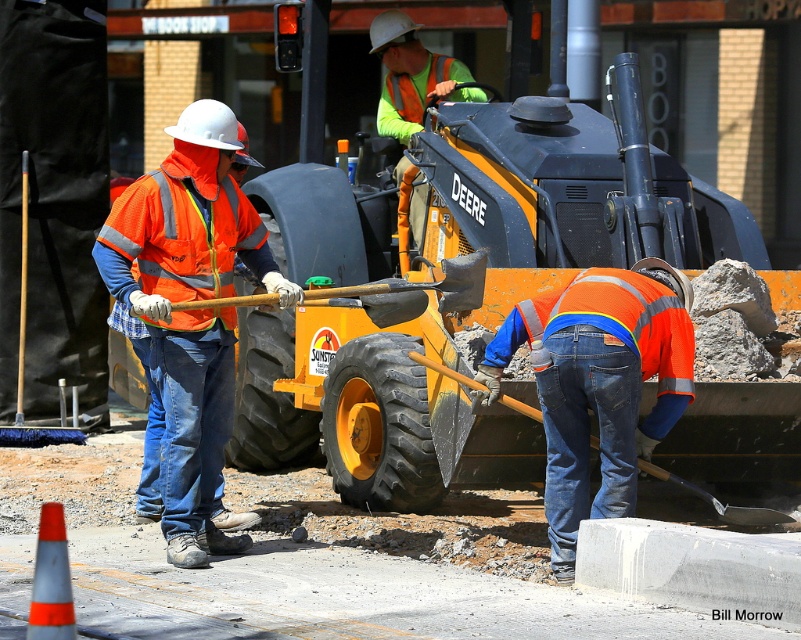
You are a new worker arriving at the construction site. You need to locate the orange reflective vest at left. Where should you look?

The orange reflective vest at left is located at point (187,317).

You are a safety inspector walking towards the orange reflective vest at left and the gray concrete block at lower right. Which object will you encounter first?

You will encounter the orange reflective vest at left first because it is closer to you than the gray concrete block at lower right, which is further away.